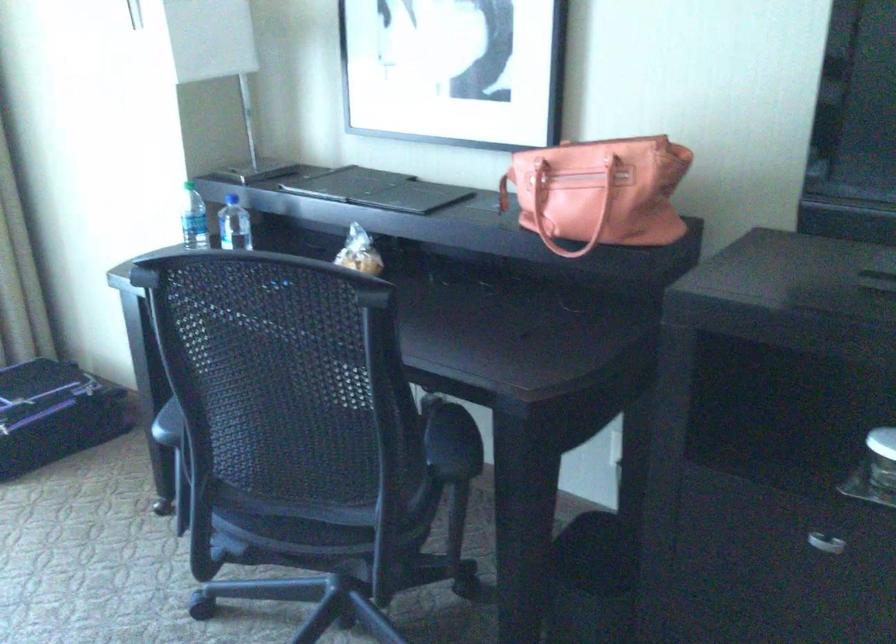
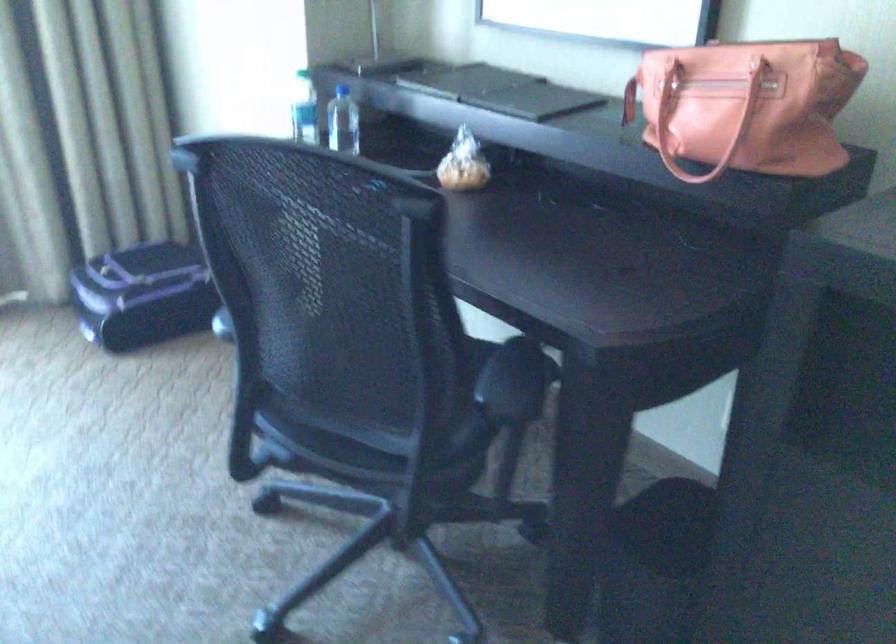
The images are taken continuously from a first-person perspective. In which direction are you moving?

The movement direction of the cameraman is right, forward.